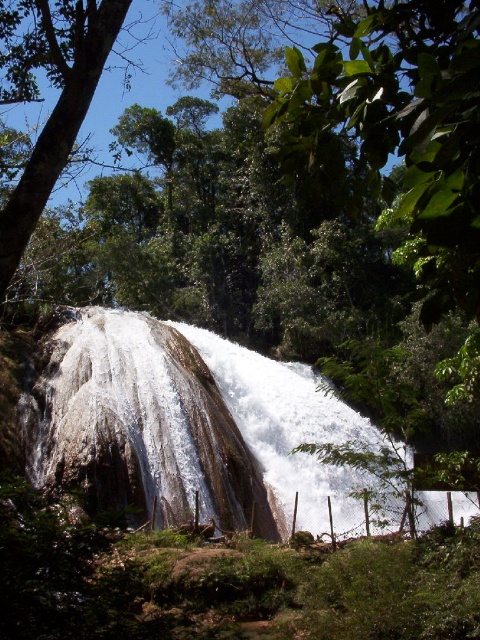
Question: Which point is closer to the camera taking this photo?

Choices:
 (A) (266, 419)
 (B) (0, 237)

Answer: (B)

Question: Does white smooth waterfall at center appear over green leafy tree at upper left?

Choices:
 (A) no
 (B) yes

Answer: (A)

Question: Is white smooth waterfall at center behind green leafy tree at upper left?

Choices:
 (A) yes
 (B) no

Answer: (A)

Question: Which point is closer to the camera?

Choices:
 (A) (237, 388)
 (B) (54, 115)

Answer: (B)

Question: Which point appears closest to the camera in this image?

Choices:
 (A) (85, 65)
 (B) (210, 476)

Answer: (A)

Question: Is white smooth waterfall at center above green leafy tree at upper left?

Choices:
 (A) no
 (B) yes

Answer: (A)